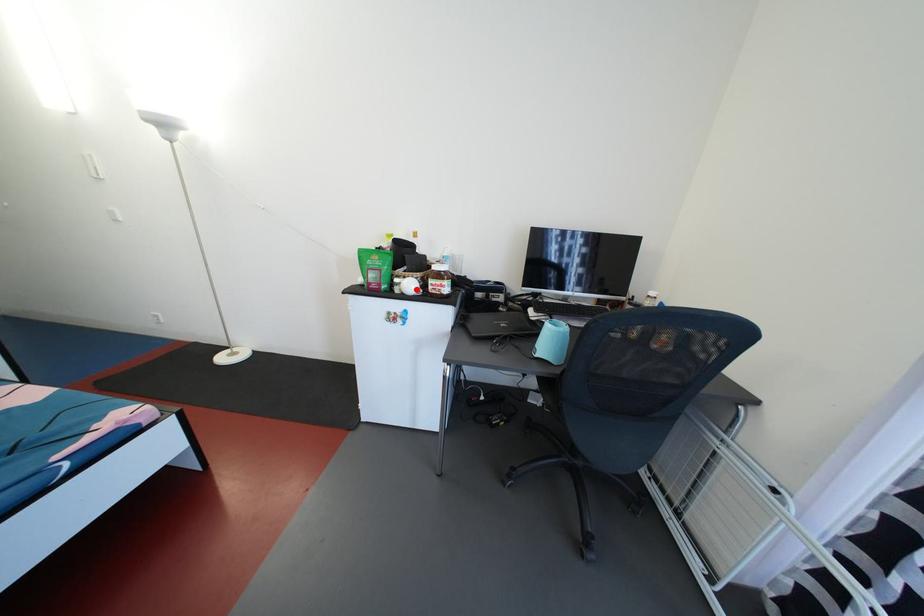
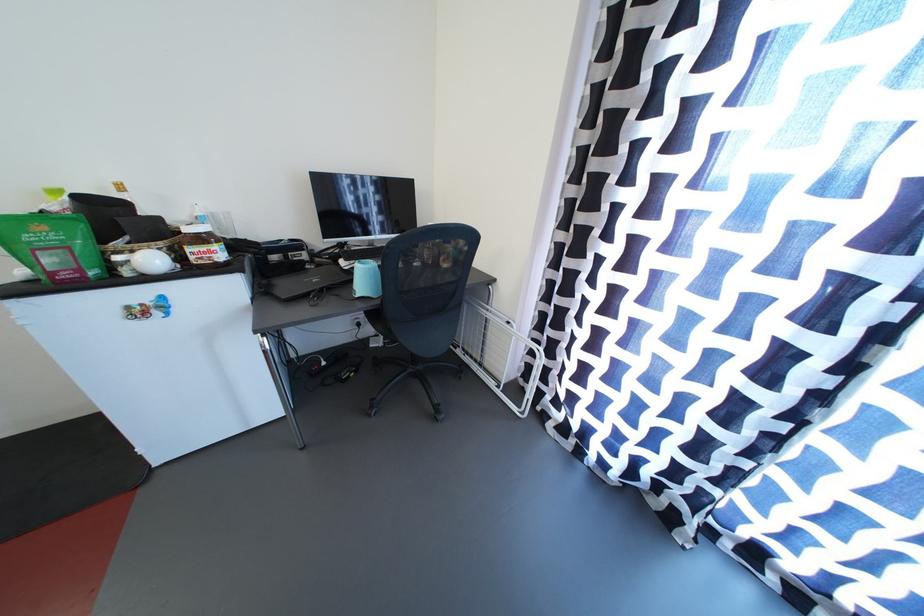
Where in the second image is the point corresponding to the highlighted location from the first image?

(157, 265)